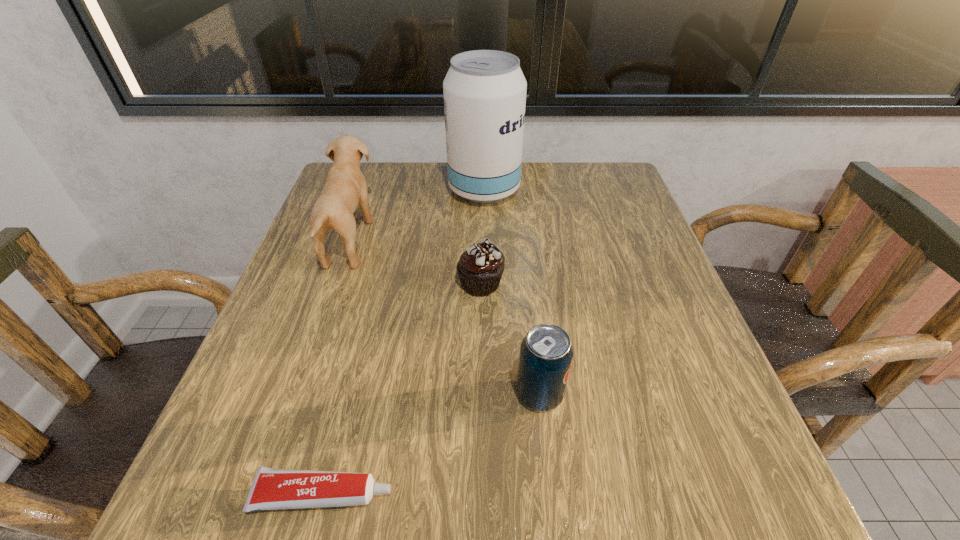
Locate an element on the screen. the tallest object is located at coordinates (484, 91).

You are a GUI agent. You are given a task and a screenshot of the screen. Output one action in this format:
    pyautogui.click(x=<x>, y=<y>)
    Task: Click on the puppy
    
    Given the screenshot: What is the action you would take?
    pyautogui.click(x=346, y=187)

This screenshot has height=540, width=960. Identify the location of soda can. (546, 353).

The height and width of the screenshot is (540, 960). Identify the location of the second nearest object. (546, 353).

At what (x,y) coordinates should I click in order to perform the action: click on cupcake. Please return your answer as a coordinate pair (x, y). The width and height of the screenshot is (960, 540). Looking at the image, I should click on (480, 268).

Where is `toothpaste`? toothpaste is located at coordinates (272, 489).

Find the location of a particular element. Image resolution: width=960 pixels, height=540 pixels. the shortest object is located at coordinates (272, 489).

Find the location of `vacant space located 0.090m on the left of the alcohol`. vacant space located 0.090m on the left of the alcohol is located at coordinates (413, 190).

The image size is (960, 540). What are the coordinates of `free point located on the left side of the puppy` in the screenshot? It's located at (500, 240).

This screenshot has height=540, width=960. Find the location of `vacant region located on the back of the soda can`. vacant region located on the back of the soda can is located at coordinates (531, 314).